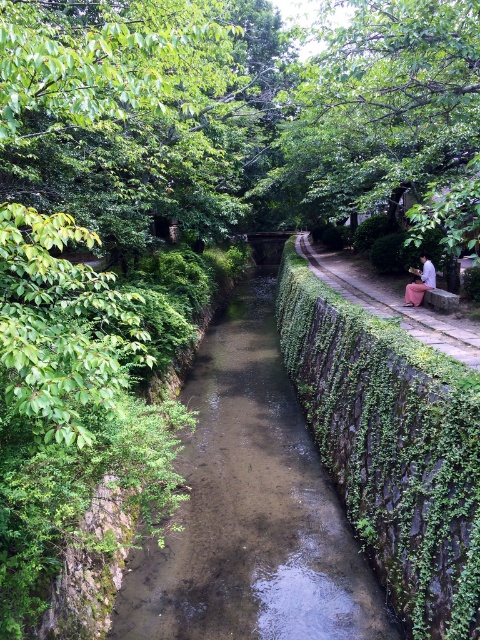
This screenshot has width=480, height=640. What do you see at coordinates (392, 445) in the screenshot?
I see `green ivy hedge at right` at bounding box center [392, 445].

Is point (422, 632) closer to camera compared to point (409, 310)?

Yes, it is in front of point (409, 310).

The width and height of the screenshot is (480, 640). I want to click on green ivy hedge at right, so click(x=392, y=445).

Does clear water stream at center appear over light pink fabric at right?

Incorrect, clear water stream at center is not positioned above light pink fabric at right.

Who is more distant from viewer, (204, 397) or (432, 282)?

Positioned behind is point (204, 397).

Describe the element at coordinates (250, 508) in the screenshot. The height and width of the screenshot is (640, 480). I see `clear water stream at center` at that location.

Find the location of a particular element. The width and height of the screenshot is (480, 640). clear water stream at center is located at coordinates (250, 508).

Does clear water stream at center have a smaller size compared to green ivy hedge at right?

Actually, clear water stream at center might be larger than green ivy hedge at right.

Is point (271, 484) positioned behind point (442, 612)?

Yes.

Between point (264, 552) and point (384, 500), which one is positioned behind?

Point (264, 552)

At what (x,y) coordinates should I click in order to perform the action: click on clear water stream at center. Please return your answer as a coordinate pair (x, y). Looking at the image, I should click on (250, 508).